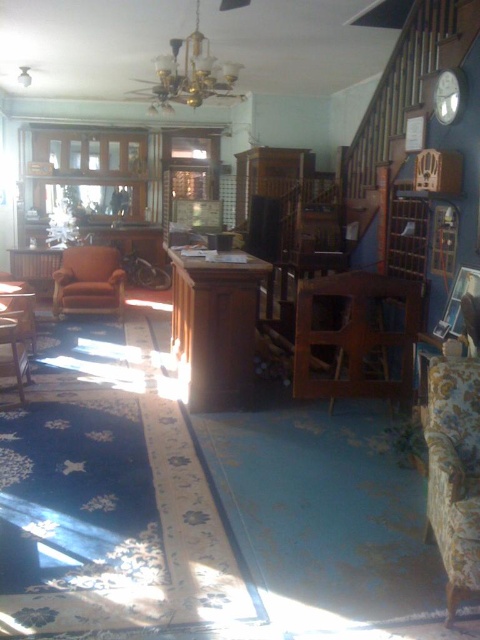
Who is positioned more to the right, floral fabric armchair at lower right or leather armchair at center?

floral fabric armchair at lower right is more to the right.

Describe the element at coordinates (454, 470) in the screenshot. I see `floral fabric armchair at lower right` at that location.

Is point (466, 381) closer to camera compared to point (122, 305)?

Yes, it is in front of point (122, 305).

Locate an element on the screen. Image resolution: width=480 pixels, height=640 pixels. floral fabric armchair at lower right is located at coordinates (454, 470).

Does floral fabric armchair at lower right have a lesser width compared to metallic gold chandelier at upper center?

Indeed, floral fabric armchair at lower right has a lesser width compared to metallic gold chandelier at upper center.

Measure the distance between point [466,410] and camera.

They are 2.45 meters apart.

The image size is (480, 640). Find the location of `floral fabric armchair at lower right`. floral fabric armchair at lower right is located at coordinates (454, 470).

Does metallic gold chandelier at upper center lie in front of leather armchair at center?

Yes, it is.

Locate an element on the screen. metallic gold chandelier at upper center is located at coordinates (188, 74).

Identify the location of metallic gold chandelier at upper center. The height and width of the screenshot is (640, 480). (188, 74).

Where is `metallic gold chandelier at upper center`? This screenshot has width=480, height=640. metallic gold chandelier at upper center is located at coordinates (188, 74).